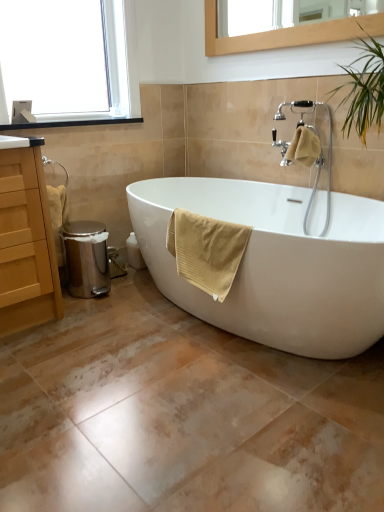
Locate an element on the screen. The image size is (384, 512). free space underneath yellow cotton towel at lower center, positioned as the second bath towel in top-to-bottom order (from a real-world perspective) is located at coordinates (195, 339).